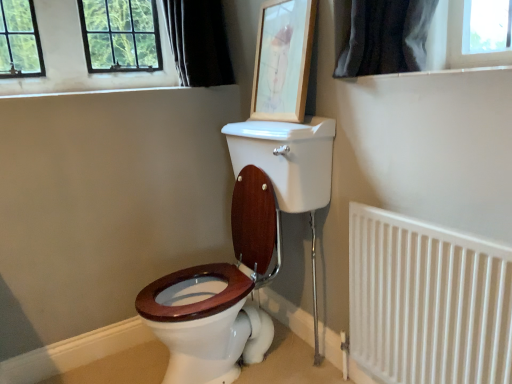
Question: Does white metal radiator at lower right turn towards black fabric curtain at upper left?

Choices:
 (A) yes
 (B) no

Answer: (B)

Question: Can you confirm if white metal radiator at lower right is positioned to the right of black fabric curtain at upper left?

Choices:
 (A) yes
 (B) no

Answer: (A)

Question: Is white metal radiator at lower right at the left side of black fabric curtain at upper left?

Choices:
 (A) yes
 (B) no

Answer: (B)

Question: Is white metal radiator at lower right outside of black fabric curtain at upper left?

Choices:
 (A) yes
 (B) no

Answer: (A)

Question: Are white metal radiator at lower right and black fabric curtain at upper left located far from each other?

Choices:
 (A) no
 (B) yes

Answer: (B)

Question: In the image, is white metal radiator at lower right on the left side or the right side of wooden picture frame at upper center?

Choices:
 (A) right
 (B) left

Answer: (A)

Question: Considering the positions of point (464, 316) and point (275, 84), is point (464, 316) closer or farther from the camera than point (275, 84)?

Choices:
 (A) closer
 (B) farther

Answer: (A)

Question: From a real-world perspective, is white metal radiator at lower right positioned above or below wooden picture frame at upper center?

Choices:
 (A) below
 (B) above

Answer: (A)

Question: Considering the positions of white metal radiator at lower right and wooden picture frame at upper center in the image, is white metal radiator at lower right taller or shorter than wooden picture frame at upper center?

Choices:
 (A) short
 (B) tall

Answer: (B)

Question: Which is correct: black fabric curtain at upper left is inside white metal radiator at lower right, or outside of it?

Choices:
 (A) outside
 (B) inside

Answer: (A)

Question: Looking at the image, does black fabric curtain at upper left seem bigger or smaller compared to white metal radiator at lower right?

Choices:
 (A) small
 (B) big

Answer: (B)

Question: Does point (x=177, y=31) appear closer or farther from the camera than point (x=365, y=235)?

Choices:
 (A) farther
 (B) closer

Answer: (A)

Question: Considering the positions of black fabric curtain at upper left and white metal radiator at lower right in the image, is black fabric curtain at upper left taller or shorter than white metal radiator at lower right?

Choices:
 (A) tall
 (B) short

Answer: (B)

Question: Is point (229, 74) closer or farther from the camera than point (306, 71)?

Choices:
 (A) farther
 (B) closer

Answer: (A)

Question: Considering the positions of black fabric curtain at upper left and wooden picture frame at upper center in the image, is black fabric curtain at upper left wider or thinner than wooden picture frame at upper center?

Choices:
 (A) thin
 (B) wide

Answer: (B)